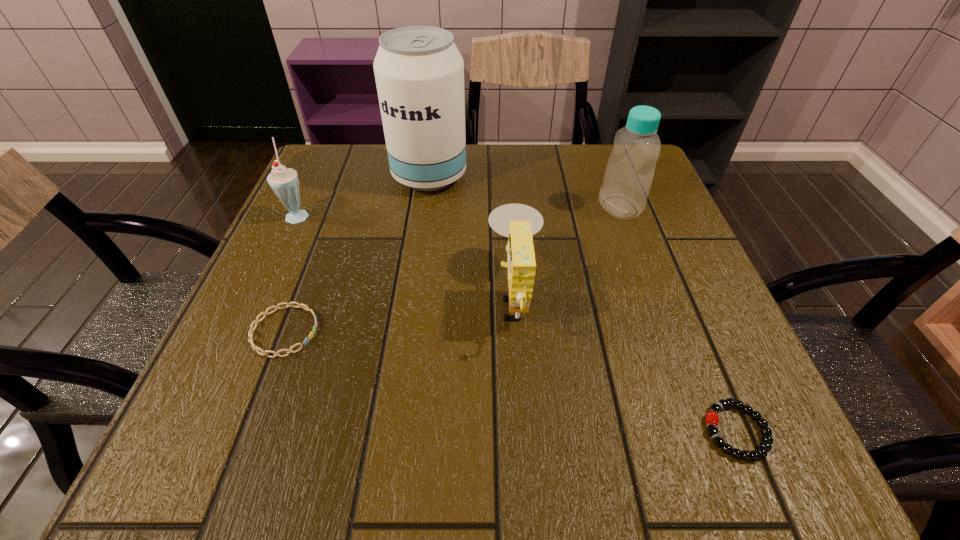
At what (x,y) coordinates should I click in order to perform the action: click on vacant space located on the straw side of the milkshake. Please return your answer as a coordinate pair (x, y). Image resolution: width=960 pixels, height=540 pixels. Looking at the image, I should click on (449, 214).

The width and height of the screenshot is (960, 540). In order to click on free region located on the front-facing side of the sponge in this screenshot , I will do `click(339, 295)`.

Where is `vacant space located on the front-facing side of the sponge`? This screenshot has width=960, height=540. vacant space located on the front-facing side of the sponge is located at coordinates click(x=272, y=295).

Locate an element on the screen. This screenshot has height=540, width=960. free space located 0.280m on the front-facing side of the sponge is located at coordinates (333, 295).

At what (x,y) coordinates should I click in order to perform the action: click on vacant area situated on the surface of the farther bracelet showing star-shaped elements. Please return your answer as a coordinate pair (x, y). The width and height of the screenshot is (960, 540). Looking at the image, I should click on (491, 331).

The image size is (960, 540). Find the location of `free spot located on the left of the right bracelet`. free spot located on the left of the right bracelet is located at coordinates (612, 431).

Identify the location of alcohol that is positioned at the far edge. (419, 72).

Where is `bottle that is positioned at the far edge`? Image resolution: width=960 pixels, height=540 pixels. bottle that is positioned at the far edge is located at coordinates (629, 173).

Where is `object located at the near edge`? The image size is (960, 540). object located at the near edge is located at coordinates (712, 418).

The height and width of the screenshot is (540, 960). In order to click on milkshake present at the left edge in this screenshot , I will do (x=284, y=182).